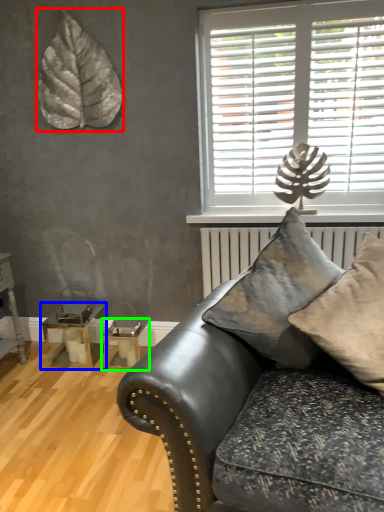
Question: Which object is the farthest from leaf (highlighted by a red box)? Choose among these: table (highlighted by a blue box) or table (highlighted by a green box).

Choices:
 (A) table
 (B) table

Answer: (B)